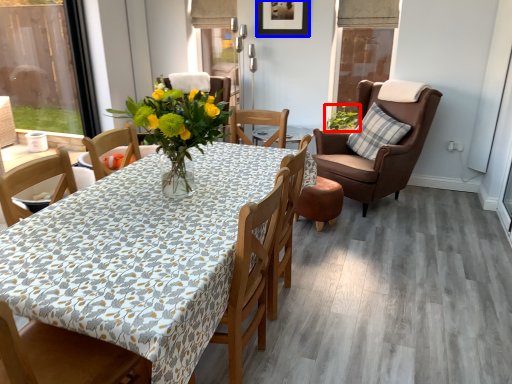
Question: Which point is further to the camera, houseplant (highlighted by a red box) or picture frame (highlighted by a blue box)?

Choices:
 (A) houseplant
 (B) picture frame

Answer: (A)